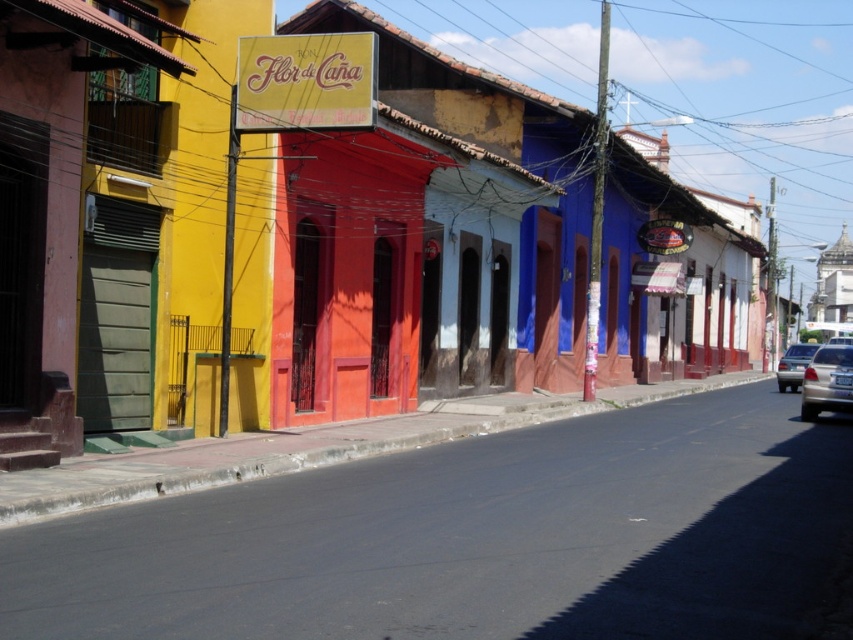
Question: Which point appears farthest from the camera in this image?

Choices:
 (A) (813, 374)
 (B) (776, 368)

Answer: (B)

Question: Does silver metallic car at lower right appear on the right side of satin silver sedan at lower right?

Choices:
 (A) no
 (B) yes

Answer: (B)

Question: Is the position of silver metallic car at lower right more distant than that of satin silver sedan at lower right?

Choices:
 (A) yes
 (B) no

Answer: (B)

Question: Is silver metallic car at lower right thinner than satin silver sedan at lower right?

Choices:
 (A) no
 (B) yes

Answer: (A)